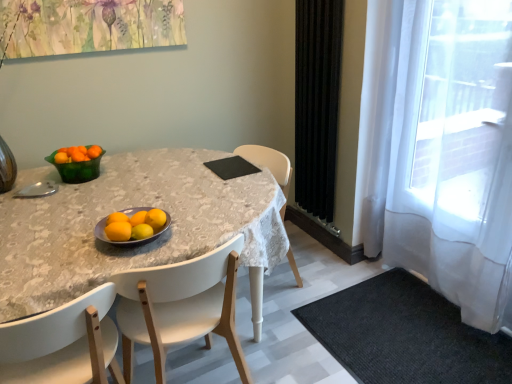
Locate an element on the screen. orange matte tangerine at upper left, the 2th tangerine when ordered from left to right is located at coordinates (94, 151).

What is the approximate width of orange matte at center, arranged as the third tangerine when viewed from the top?

2.57 inches.

At what (x,y) coordinates should I click in order to perform the action: click on orange matte at center, placed as the 1th tangerine when sorted from right to left. Please return your answer as a coordinate pair (x, y). Looking at the image, I should click on (156, 218).

Describe the element at coordinates (77, 169) in the screenshot. I see `green glass bowl at upper left, which is counted as the first bowl, starting from the top` at that location.

In order to click on white wood chair at center, positioned as the 2th chair in left-to-right order in this screenshot , I will do `click(180, 306)`.

At what (x,y) coordinates should I click in order to perform the action: click on orange matte tangerine at upper left, positioned as the 4th tangerine in front-to-back order. Please return your answer as a coordinate pair (x, y). The image size is (512, 384). Looking at the image, I should click on (94, 151).

Is orange matte at center, the 1th orange when ordered from front to back, turned away from orange matte at center, positioned as the first tangerine in bottom-to-top order?

orange matte at center, the 1th orange when ordered from front to back, is not turned away from orange matte at center, positioned as the first tangerine in bottom-to-top order.

From the image's perspective, is orange matte at center, arranged as the third orange when viewed from the back, on orange matte at center, which ranks as the second tangerine in front-to-back order?

No, from the image's perspective, orange matte at center, arranged as the third orange when viewed from the back, is not over orange matte at center, which ranks as the second tangerine in front-to-back order.

Is orange matte at center, arranged as the third orange when viewed from the back, outside of orange matte at center, which appears as the 3th tangerine when viewed from the left?

Yes, orange matte at center, arranged as the third orange when viewed from the back, is outside of orange matte at center, which appears as the 3th tangerine when viewed from the left.

From the picture: Is white wood chair at center, positioned as the 2th chair in left-to-right order, closer to camera compared to orangesmoothfruit at center, marked as the third orange in a front-to-back arrangement?

Yes, white wood chair at center, positioned as the 2th chair in left-to-right order, is in front of orangesmoothfruit at center, marked as the third orange in a front-to-back arrangement.

From the image's perspective, is white wood chair at center, which appears as the first chair when viewed from the right, under orangesmoothfruit at center, marked as the third orange in a front-to-back arrangement?

Correct, white wood chair at center, which appears as the first chair when viewed from the right, appears lower than orangesmoothfruit at center, marked as the third orange in a front-to-back arrangement, in the image.

Consider the image. Is white wood chair at center, positioned as the 2th chair in left-to-right order, taller or shorter than orangesmoothfruit at center, marked as the third orange in a front-to-back arrangement?

Clearly, white wood chair at center, positioned as the 2th chair in left-to-right order, is taller compared to orangesmoothfruit at center, marked as the third orange in a front-to-back arrangement.

Is white wood chair at center, which appears as the first chair when viewed from the right, positioned with its back to orangesmoothfruit at center, marked as the third orange in a front-to-back arrangement?

That's not correct — white wood chair at center, which appears as the first chair when viewed from the right, is not looking away from orangesmoothfruit at center, marked as the third orange in a front-to-back arrangement.

Is there a large distance between black textured rug at lower right and white sheer curtain at right, acting as the 2th curtain starting from the left?

That's not correct — black textured rug at lower right is a little close to white sheer curtain at right, acting as the 2th curtain starting from the left.

Is black textured rug at lower right at the left side of white sheer curtain at right, acting as the 2th curtain starting from the left?

Yes, black textured rug at lower right is to the left of white sheer curtain at right, acting as the 2th curtain starting from the left.

In the scene shown: Measure the distance between black textured rug at lower right and white sheer curtain at right, arranged as the 1th curtain when viewed from the right.

black textured rug at lower right is 21.68 inches away from white sheer curtain at right, arranged as the 1th curtain when viewed from the right.

Is black textured rug at lower right positioned with its back to white sheer curtain at right, acting as the 2th curtain starting from the left?

No, white sheer curtain at right, acting as the 2th curtain starting from the left, is not at the back of black textured rug at lower right.

Considering the points (67, 158) and (270, 240), which point is in front, point (67, 158) or point (270, 240)?

The point (270, 240) is closer.

Is orange matte bowl at upper left, which ranks as the 2th tangerine in top-to-bottom order, thinner than white glossy table at center?

Indeed, orange matte bowl at upper left, which ranks as the 2th tangerine in top-to-bottom order, has a lesser width compared to white glossy table at center.

Consider the image. Is the position of orange matte bowl at upper left, marked as the first tangerine in a left-to-right arrangement, more distant than that of white glossy table at center?

Yes, it is.

Looking at this image, from the image's perspective, which is above, orange matte bowl at upper left, marked as the first tangerine in a left-to-right arrangement, or white glossy table at center?

orange matte bowl at upper left, marked as the first tangerine in a left-to-right arrangement, is shown above in the image.

Is white plastic chair at lower center, the first chair in the left-to-right sequence, taller or shorter than matte gray bowl at center, acting as the second bowl starting from the top?

Considering their sizes, white plastic chair at lower center, the first chair in the left-to-right sequence, has more height than matte gray bowl at center, acting as the second bowl starting from the top.

From the image's perspective, which object appears higher, white plastic chair at lower center, the first chair in the left-to-right sequence, or matte gray bowl at center, which ranks as the first bowl in right-to-left order?

matte gray bowl at center, which ranks as the first bowl in right-to-left order, is shown above in the image.

Considering the sizes of objects white plastic chair at lower center, the first chair in the left-to-right sequence, and matte gray bowl at center, the 2th bowl from the left, in the image provided, who is bigger, white plastic chair at lower center, the first chair in the left-to-right sequence, or matte gray bowl at center, the 2th bowl from the left,?

Bigger between the two is white plastic chair at lower center, the first chair in the left-to-right sequence.

Is white plastic chair at lower center, which is the 2th chair in right-to-left order, located outside matte gray bowl at center, which ranks as the first bowl in right-to-left order?

Yes.

Is point (117, 213) less distant than point (373, 383)?

Yes.

Between orangesmoothfruit at center, which appears as the 1th orange when viewed from the back, and black textured rug at lower right, which one is positioned behind?

Positioned behind is black textured rug at lower right.

From a real-world perspective, starting from the black textured rug at lower right, which orange is the 2nd one vertically above it? Please provide its 2D coordinates.

[(117, 218)]

Is matte gray bowl at center, the 2th bowl from the left, to the right of orange matte tangerine at upper left, which is counted as the fourth tangerine, starting from the bottom, from the viewer's perspective?

Correct, you'll find matte gray bowl at center, the 2th bowl from the left, to the right of orange matte tangerine at upper left, which is counted as the fourth tangerine, starting from the bottom.

From the image's perspective, is matte gray bowl at center, which appears as the 1th bowl when viewed from the front, on orange matte tangerine at upper left, the first tangerine viewed from the back?

No.

Could you tell me if matte gray bowl at center, acting as the second bowl starting from the top, is turned towards orange matte tangerine at upper left, which is counted as the fourth tangerine, starting from the bottom?

No, matte gray bowl at center, acting as the second bowl starting from the top, does not turn towards orange matte tangerine at upper left, which is counted as the fourth tangerine, starting from the bottom.

Is matte gray bowl at center, which ranks as the 2th bowl in back-to-front order, not near orange matte tangerine at upper left, marked as the 3th tangerine in a right-to-left arrangement?

Actually, matte gray bowl at center, which ranks as the 2th bowl in back-to-front order, and orange matte tangerine at upper left, marked as the 3th tangerine in a right-to-left arrangement, are a little close together.

From a real-world perspective, which orange is the 3rd one above the orange matte at center, positioned as the first tangerine in bottom-to-top order? Please provide its 2D coordinates.

[(118, 231)]

From a real-world perspective, count 1st chairs downward from the orangesmoothfruit at center, which appears as the 1th orange when viewed from the back, and point to it. Please provide its 2D coordinates.

[(180, 306)]

Looking at the image, which one is located closer to orange matte at center, which is the 4th tangerine in back-to-front order, black velvet curtain at right, positioned as the first curtain in left-to-right order, or yellow matte/orange at center, positioned as the 2th orange in back-to-front order?

Based on the image, yellow matte/orange at center, positioned as the 2th orange in back-to-front order, appears to be nearer to orange matte at center, which is the 4th tangerine in back-to-front order.

Estimate the real-world distances between objects in this image. Which object is closer to orange matte tangerine at upper left, marked as the 3th tangerine in a right-to-left arrangement, orangesmoothfruit at center, marked as the third orange in a front-to-back arrangement, or white wood chair at center, positioned as the 2th chair in left-to-right order?

orangesmoothfruit at center, marked as the third orange in a front-to-back arrangement, lies closer to orange matte tangerine at upper left, marked as the 3th tangerine in a right-to-left arrangement, than the other object.

Considering their positions, is orange matte at center, the 1th orange when ordered from front to back, positioned further to orange matte tangerine at upper left, the first tangerine viewed from the back, than orange matte at center, which ranks as the second tangerine in front-to-back order?

orange matte at center, which ranks as the second tangerine in front-to-back order, is further to orange matte tangerine at upper left, the first tangerine viewed from the back.

Estimate the real-world distances between objects in this image. Which object is further from orange matte at center, the second tangerine when ordered from bottom to top, white glossy table at center or black velvet curtain at right, positioned as the first curtain in left-to-right order?

black velvet curtain at right, positioned as the first curtain in left-to-right order, is positioned further to the anchor orange matte at center, the second tangerine when ordered from bottom to top.

Considering their positions, is matte gray bowl at center, acting as the second bowl starting from the top, positioned closer to orange matte at center, placed as the 1th tangerine when sorted from right to left, than orange matte at center, the third tangerine positioned from the back?

orange matte at center, the third tangerine positioned from the back.

Considering their positions, is white wood chair at center, positioned as the 2th chair in left-to-right order, positioned further to orange matte at center, arranged as the fourth tangerine when viewed from the left, than black textured rug at lower right?

black textured rug at lower right is positioned further to the anchor orange matte at center, arranged as the fourth tangerine when viewed from the left.

Looking at the image, which one is located further to white plastic chair at lower center, which is the 2th chair in right-to-left order, white wood chair at center, which appears as the first chair when viewed from the right, or black velvet curtain at right, arranged as the 2th curtain when viewed from the right?

Based on the image, black velvet curtain at right, arranged as the 2th curtain when viewed from the right, appears to be further to white plastic chair at lower center, which is the 2th chair in right-to-left order.

Based on their spatial positions, is orange matte bowl at upper left, the fourth tangerine from the right, or orange matte at center, arranged as the third orange when viewed from the back, further from orange matte at center, arranged as the fourth tangerine when viewed from the left?

orange matte bowl at upper left, the fourth tangerine from the right.

Locate an element on the screen. This screenshot has width=512, height=384. pad located between yellow matte/orange at center, positioned as the 2th orange in back-to-front order, and black velvet curtain at right, positioned as the first curtain in left-to-right order, in the left-right direction is located at coordinates (231, 167).

Where is `orange situated between matte gray bowl at center, the 2th bowl from the left, and black velvet curtain at right, arranged as the 2th curtain when viewed from the right, from left to right`? The height and width of the screenshot is (384, 512). orange situated between matte gray bowl at center, the 2th bowl from the left, and black velvet curtain at right, arranged as the 2th curtain when viewed from the right, from left to right is located at coordinates (141, 231).

The width and height of the screenshot is (512, 384). Find the location of `bowl between white glossy table at center and black textured rug at lower right in the horizontal direction`. bowl between white glossy table at center and black textured rug at lower right in the horizontal direction is located at coordinates (128, 240).

This screenshot has height=384, width=512. Find the location of `desk between white plastic chair at lower center, the first chair in the left-to-right sequence, and orange matte bowl at upper left, the 3th tangerine in the bottom-to-top sequence, along the z-axis`. desk between white plastic chair at lower center, the first chair in the left-to-right sequence, and orange matte bowl at upper left, the 3th tangerine in the bottom-to-top sequence, along the z-axis is located at coordinates (131, 207).